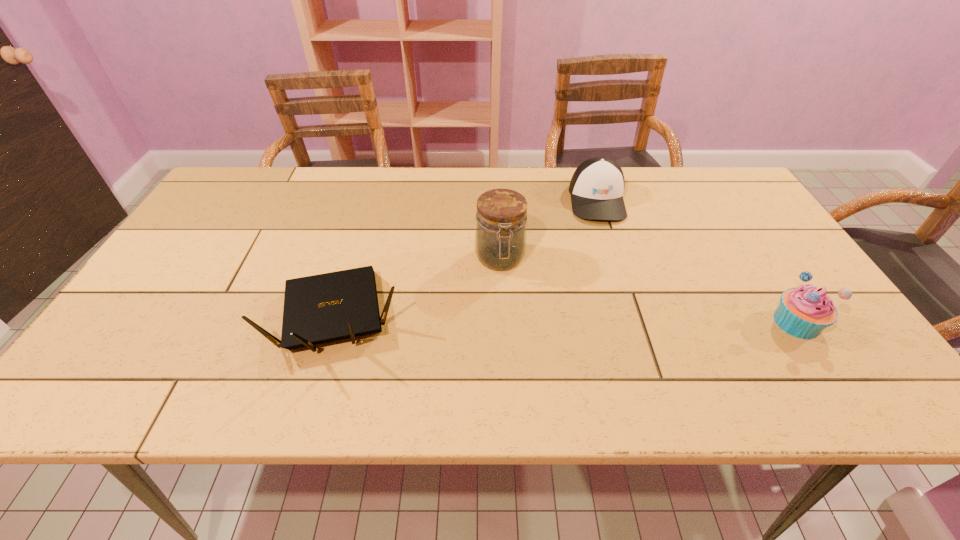
Locate an element on the screen. vacant region located 0.170m on the lid of the second object from left to right is located at coordinates (510, 332).

Locate an element on the screen. vacant space situated on the front panel of the cap is located at coordinates (617, 294).

Find the location of `free space located on the front panel of the cap`. free space located on the front panel of the cap is located at coordinates (607, 242).

Locate an element on the screen. This screenshot has height=540, width=960. blank space located 0.180m on the front panel of the cap is located at coordinates (612, 268).

Find the location of `object located at the far edge`. object located at the far edge is located at coordinates (597, 186).

At what (x,y) coordinates should I click in order to perform the action: click on router present at the near edge. Please return your answer as a coordinate pair (x, y). Image resolution: width=960 pixels, height=540 pixels. Looking at the image, I should click on (322, 308).

The image size is (960, 540). Identify the location of muffin present at the near edge. (804, 312).

You are a GUI agent. You are given a task and a screenshot of the screen. Output one action in this format:
    pyautogui.click(x=<x>, y=<y>)
    Task: Click on the object located at the right edge
    Image resolution: width=960 pixels, height=540 pixels.
    Given the screenshot: What is the action you would take?
    pyautogui.click(x=804, y=312)

Locate an element on the screen. This screenshot has width=960, height=540. object that is at the near right corner is located at coordinates (804, 312).

You are a GUI agent. You are given a task and a screenshot of the screen. Output one action in this format:
    pyautogui.click(x=<x>, y=<y>)
    Task: Click on the vacant area at the far edge of the desktop
    This screenshot has height=540, width=960.
    Given the screenshot: What is the action you would take?
    pyautogui.click(x=454, y=200)